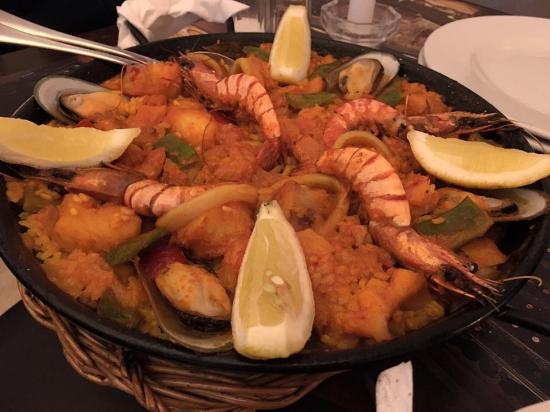
Image resolution: width=550 pixels, height=412 pixels. In order to click on napkin in this screenshot , I will do `click(159, 28)`.